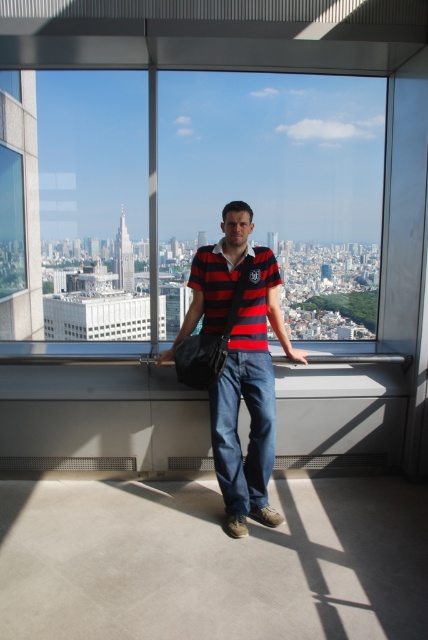
Question: Does gray concrete ledge at center have a larger size compared to striped cotton shirt at center?

Choices:
 (A) no
 (B) yes

Answer: (A)

Question: Which point is farther to the camera?

Choices:
 (A) (216, 316)
 (B) (36, 394)
 (C) (124, 160)

Answer: (C)

Question: Estimate the real-world distances between objects in this image. Which object is closer to the transparent glass window at center?

Choices:
 (A) gray concrete ledge at center
 (B) striped cotton shirt at center

Answer: (A)

Question: Which point appears farthest from the camera in this image?

Choices:
 (A) (273, 275)
 (B) (139, 464)
 (C) (228, 387)
 (D) (128, 150)

Answer: (D)

Question: Can you confirm if transparent glass window at center is thinner than red striped polo shirt at center?

Choices:
 (A) yes
 (B) no

Answer: (B)

Question: Is gray concrete ledge at center wider than red striped polo shirt at center?

Choices:
 (A) no
 (B) yes

Answer: (B)